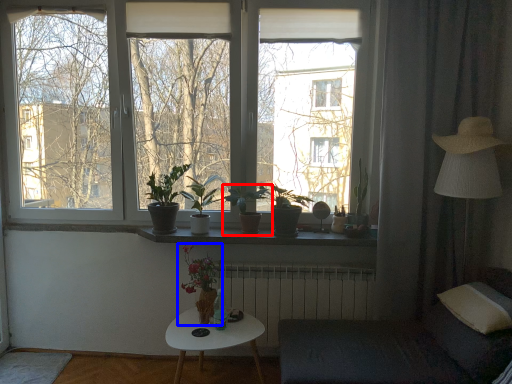
Question: Which of the following is the farthest to the observer, houseplant (highlighted by a red box) or houseplant (highlighted by a blue box)?

Choices:
 (A) houseplant
 (B) houseplant

Answer: (A)